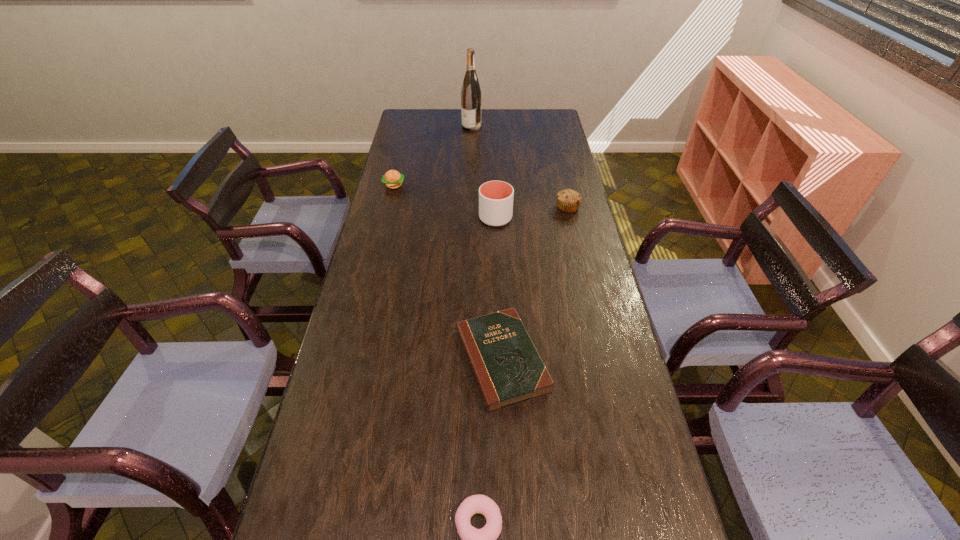
At what (x,y) coordinates should I click in order to perform the action: click on free space between the second farthest object and the second nearest object. Please return your answer as a coordinate pair (x, y). The image size is (960, 540). Looking at the image, I should click on (448, 273).

Find the location of `unoccupied area between the fourth tallest object and the second tallest object`. unoccupied area between the fourth tallest object and the second tallest object is located at coordinates (444, 202).

The width and height of the screenshot is (960, 540). I want to click on empty location between the cup and the rightmost object, so click(532, 213).

At what (x,y) coordinates should I click in order to perform the action: click on vacant point located between the second tallest object and the Bible. Please return your answer as a coordinate pair (x, y). Looking at the image, I should click on (498, 289).

Where is `object that is the second closest to the hamburger`? object that is the second closest to the hamburger is located at coordinates (471, 93).

Select which object is the second closest to the second farthest object. Please provide its 2D coordinates. Your answer should be formatted as a tuple, i.e. [(x, y)], where the tuple contains the x and y coordinates of a point satisfying the conditions above.

[(471, 93)]

This screenshot has height=540, width=960. I want to click on free location that satisfies the following two spatial constraints: 1. on the front side of the cup; 2. on the right side of the hamburger, so click(x=386, y=218).

Where is `free space that satisfies the following two spatial constraints: 1. on the front side of the tallest object; 2. on the left side of the fifth shortest object`? This screenshot has width=960, height=540. free space that satisfies the following two spatial constraints: 1. on the front side of the tallest object; 2. on the left side of the fifth shortest object is located at coordinates (468, 218).